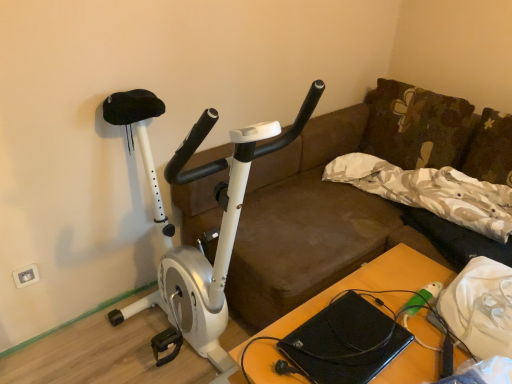
Locate an element on the screen. vacant area on the back side of black matte laptop at lower center is located at coordinates (356, 296).